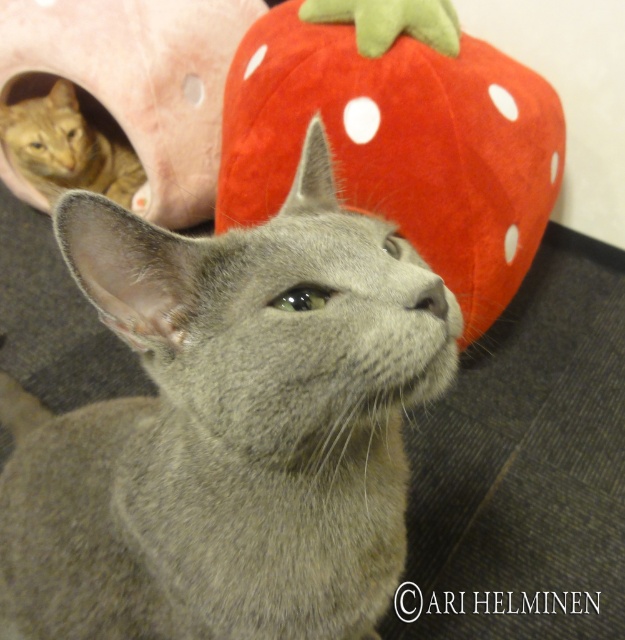
Who is more distant from viewer, (446, 276) or (205, 72)?

The point (205, 72) is more distant.

Where is `velvety red strawberry at upper center`? velvety red strawberry at upper center is located at coordinates (400, 134).

Is pink fabric cat bed at upper left thinner than orange tabby cat at left?

Incorrect, pink fabric cat bed at upper left's width is not less than orange tabby cat at left's.

Does pink fabric cat bed at upper left have a lesser height compared to orange tabby cat at left?

No, pink fabric cat bed at upper left is not shorter than orange tabby cat at left.

Between point (216, 125) and point (62, 177), which one is positioned behind?

Positioned behind is point (62, 177).

Find the location of `pink fabric cat bed at upper left`. pink fabric cat bed at upper left is located at coordinates (138, 81).

Can you confirm if gray matte fur cat at center is wider than orange tabby cat at left?

Indeed, gray matte fur cat at center has a greater width compared to orange tabby cat at left.

Can you confirm if gray matte fur cat at center is positioned above orange tabby cat at left?

No.

Describe the element at coordinates (228, 428) in the screenshot. I see `gray matte fur cat at center` at that location.

Locate an element on the screen. gray matte fur cat at center is located at coordinates pyautogui.click(x=228, y=428).